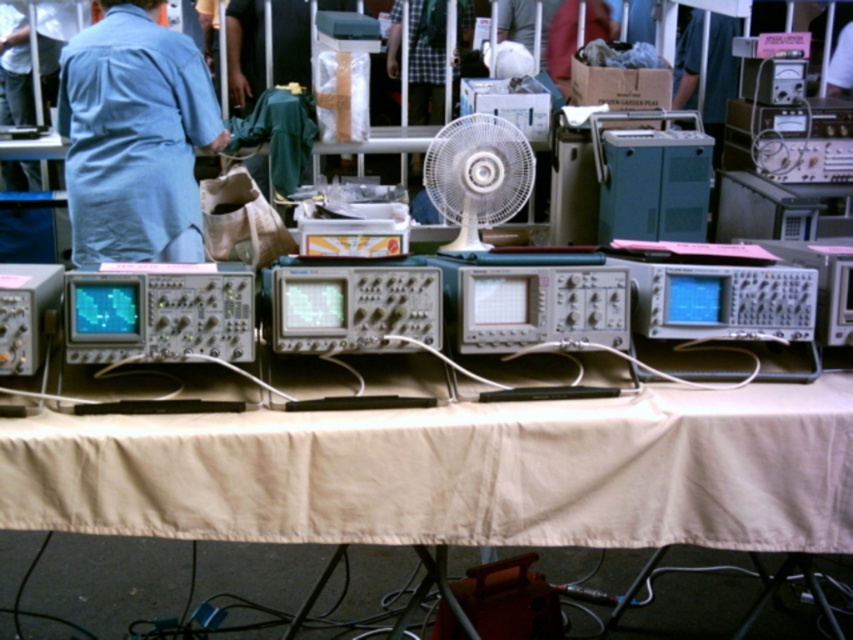
Does denim shirt at left have a greater height compared to white plastic fan at center?

Yes.

Is denim shirt at left above white plastic fan at center?

Yes.

Locate an element on the screen. The height and width of the screenshot is (640, 853). denim shirt at left is located at coordinates 134,138.

Can you confirm if beige fabric table at center is bigger than white plastic fan at center?

Yes.

Consider the image. Between beige fabric table at center and white plastic fan at center, which one is positioned higher?

white plastic fan at center is higher up.

Does point (165, 448) come farther from viewer compared to point (508, 145)?

No, (165, 448) is in front of (508, 145).

Locate an element on the screen. This screenshot has height=640, width=853. beige fabric table at center is located at coordinates (456, 472).

Who is positioned more to the left, beige fabric table at center or denim shirt at left?

Positioned to the left is denim shirt at left.

Can you confirm if beige fabric table at center is positioned above denim shirt at left?

Actually, beige fabric table at center is below denim shirt at left.

Does point (349, 500) come behind point (142, 77)?

No.

Where is `beige fabric table at center`? beige fabric table at center is located at coordinates (456, 472).